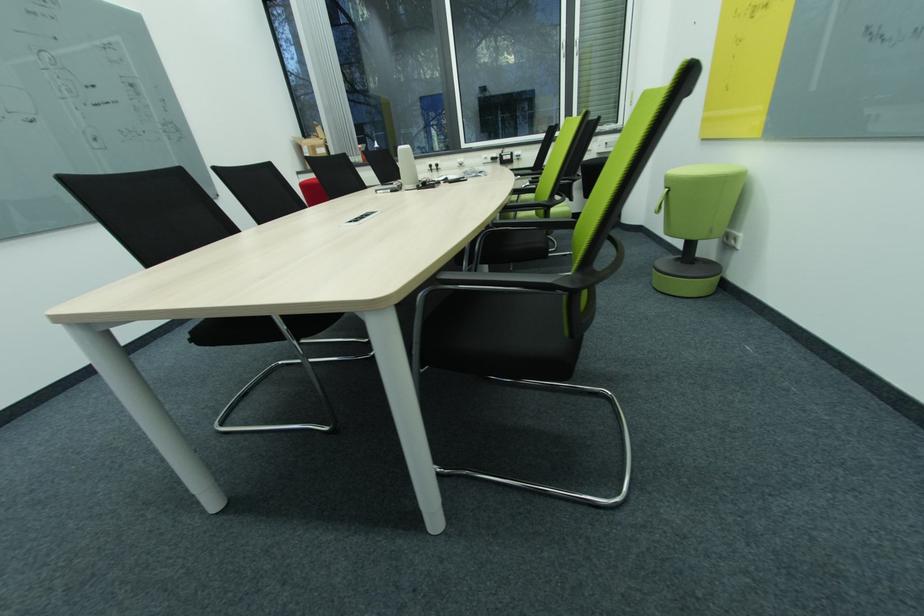
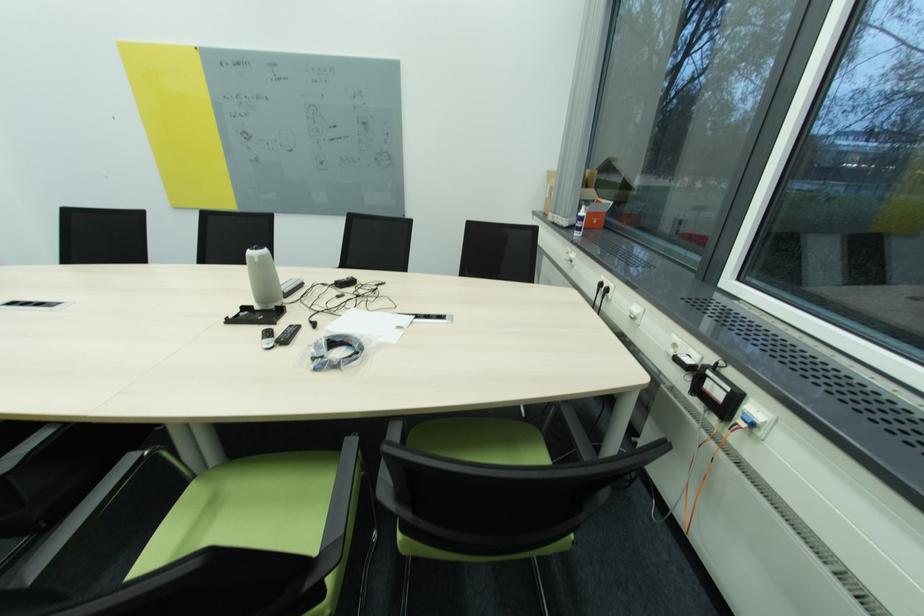
The point at (x=491, y=159) is marked in the first image. Where is the corresponding point in the second image?

(679, 346)